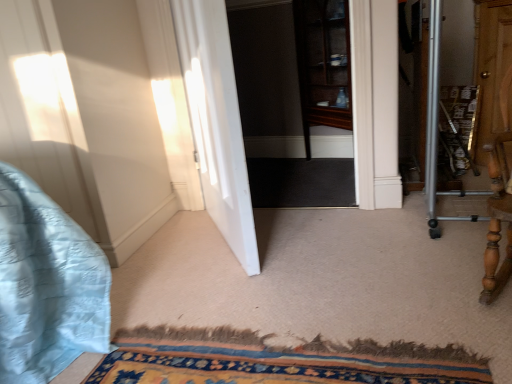
The image size is (512, 384). I want to click on transparent glass cabinet at center, so click(x=295, y=101).

Measure the distance between point (364,364) and camera.

Point (364,364) is 1.08 meters away from camera.

You are a GUI agent. You are given a task and a screenshot of the screen. Output one action in this format:
    pyautogui.click(x=<x>, y=<y>)
    Task: Click on the white smooth door at center
    
    Given the screenshot: What is the action you would take?
    pos(216,122)

Is white smooth door at center positioned beyond the bounds of carpeted mat at lower center?

white smooth door at center is positioned outside carpeted mat at lower center.

From a real-world perspective, which object stands above the other?

In real-world perspective, white smooth door at center is above.

Based on the photo, considering the sizes of objects white smooth door at center and carpeted mat at lower center in the image provided, who is smaller, white smooth door at center or carpeted mat at lower center?

Smaller between the two is carpeted mat at lower center.

Locate an element on the screen. The height and width of the screenshot is (384, 512). door located above the transparent glass cabinet at center (from a real-world perspective) is located at coordinates (216, 122).

Which object is positioned more to the left, transparent glass cabinet at center or white smooth door at center?

white smooth door at center.

From a real-world perspective, is transparent glass cabinet at center physically below white smooth door at center?

Yes, from a real-world perspective, transparent glass cabinet at center is under white smooth door at center.

In the scene shown: Considering their positions, is white smooth door at center located in front of or behind transparent glass cabinet at center?

white smooth door at center is in front of transparent glass cabinet at center.

Is white smooth door at center directly adjacent to transparent glass cabinet at center?

No, white smooth door at center is not making contact with transparent glass cabinet at center.

Is white smooth door at center oriented away from transparent glass cabinet at center?

Yes, transparent glass cabinet at center is at the back of white smooth door at center.

Is white smooth door at center smaller than transparent glass cabinet at center?

No.

From a real-world perspective, which object rests below the other?

In real-world perspective, carpeted mat at lower center is lower.

Is transparent glass cabinet at center oriented away from carpeted mat at lower center?

No, transparent glass cabinet at center is not facing the opposite direction of carpeted mat at lower center.

What's the angular difference between transparent glass cabinet at center and carpeted mat at lower center's facing directions?

The facing directions of transparent glass cabinet at center and carpeted mat at lower center are 87.1 degrees apart.

Between transparent glass cabinet at center and carpeted mat at lower center, which one has larger size?

transparent glass cabinet at center.

Which of these two, carpeted mat at lower center or white smooth door at center, stands taller?

white smooth door at center.

Which is behind, carpeted mat at lower center or white smooth door at center?

white smooth door at center is further away from the camera.

From the image's perspective, is carpeted mat at lower center positioned above or below white smooth door at center?

Clearly, from the image's perspective, carpeted mat at lower center is below white smooth door at center.

Based on the photo, from a real-world perspective, who is located lower, carpeted mat at lower center or transparent glass cabinet at center?

In real-world perspective, carpeted mat at lower center is lower.

Does point (272, 380) lie in front of point (301, 108)?

Yes, point (272, 380) is in front of point (301, 108).

Between carpeted mat at lower center and transparent glass cabinet at center, which one is positioned in front?

carpeted mat at lower center is more forward.

Can you see carpeted mat at lower center touching transparent glass cabinet at center?

No.

Find the location of `door above the carpeted mat at lower center (from a real-world perspective)`. door above the carpeted mat at lower center (from a real-world perspective) is located at coordinates (216, 122).

Locate an element on the screen. door located below the transparent glass cabinet at center (from the image's perspective) is located at coordinates (216, 122).

Estimate the real-world distances between objects in this image. Which object is closer to transparent glass cabinet at center, carpeted mat at lower center or white smooth door at center?

white smooth door at center lies closer to transparent glass cabinet at center than the other object.

Estimate the real-world distances between objects in this image. Which object is further from transparent glass cabinet at center, white smooth door at center or carpeted mat at lower center?

carpeted mat at lower center lies further to transparent glass cabinet at center than the other object.

Which object lies nearer to the anchor point white smooth door at center, carpeted mat at lower center or transparent glass cabinet at center?

carpeted mat at lower center.

Estimate the real-world distances between objects in this image. Which object is further from white smooth door at center, transparent glass cabinet at center or carpeted mat at lower center?

The object further to white smooth door at center is transparent glass cabinet at center.

When comparing their distances from carpeted mat at lower center, does transparent glass cabinet at center or white smooth door at center seem closer?

white smooth door at center is positioned closer to the anchor carpeted mat at lower center.

Looking at the image, which one is located closer to carpeted mat at lower center, white smooth door at center or transparent glass cabinet at center?

Based on the image, white smooth door at center appears to be nearer to carpeted mat at lower center.

This screenshot has width=512, height=384. Identify the location of door between carpeted mat at lower center and transparent glass cabinet at center from front to back. (216, 122).